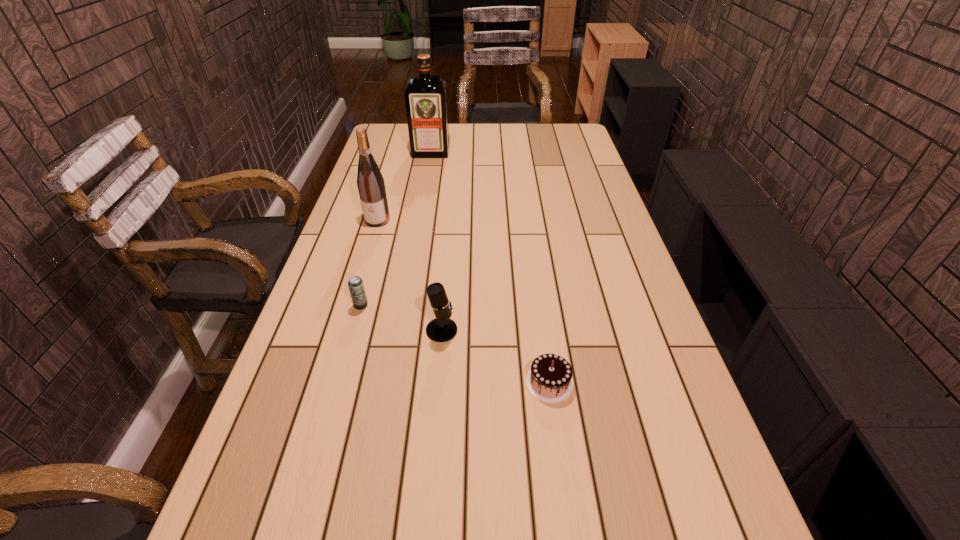
I want to click on the tallest object, so click(x=425, y=96).

Locate an element on the screen. the farthest object is located at coordinates (425, 96).

The height and width of the screenshot is (540, 960). What are the coordinates of `the second tallest object` in the screenshot? It's located at click(370, 182).

Image resolution: width=960 pixels, height=540 pixels. I want to click on the fourth nearest object, so click(x=370, y=182).

Locate an element on the screen. the second nearest object is located at coordinates (442, 329).

The width and height of the screenshot is (960, 540). In order to click on microphone in this screenshot , I will do `click(442, 329)`.

Locate an element on the screen. The image size is (960, 540). the third nearest object is located at coordinates (356, 287).

The image size is (960, 540). I want to click on the rightmost object, so click(x=549, y=380).

Where is `the nearest object`? This screenshot has height=540, width=960. the nearest object is located at coordinates (549, 380).

Locate an element on the screen. free space located on the front label of the liquor is located at coordinates (423, 191).